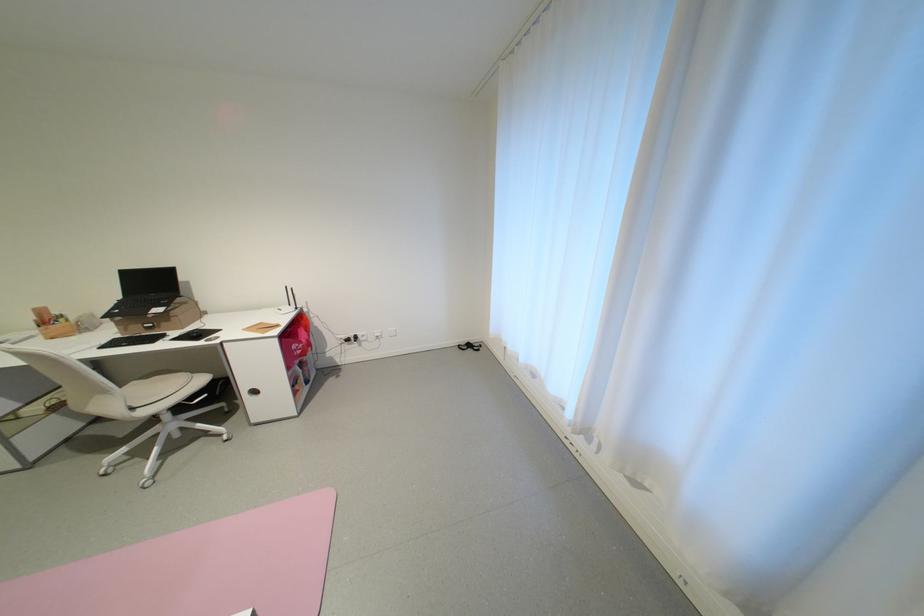
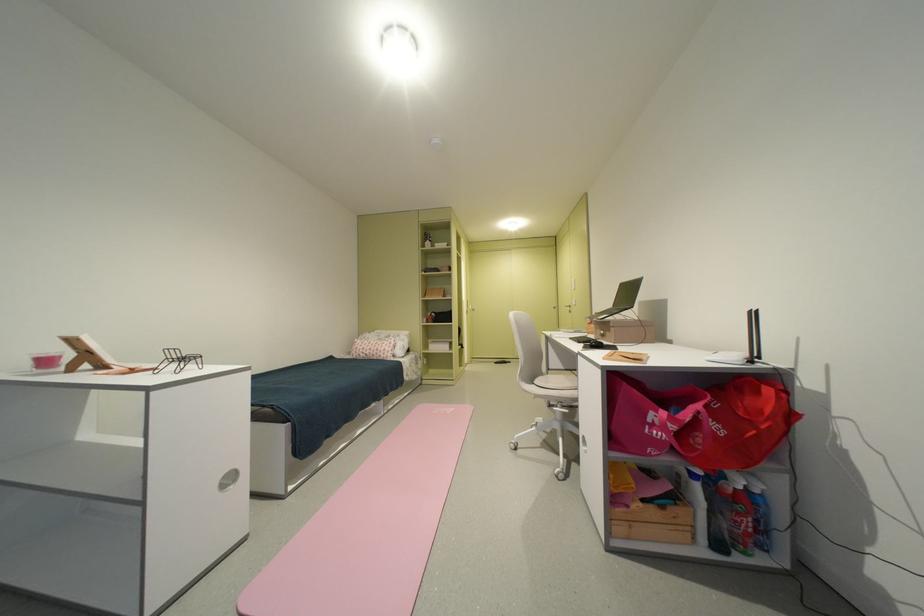
In the second image, find the point that corresponds to the point at 146,408 in the first image.

(543, 383)